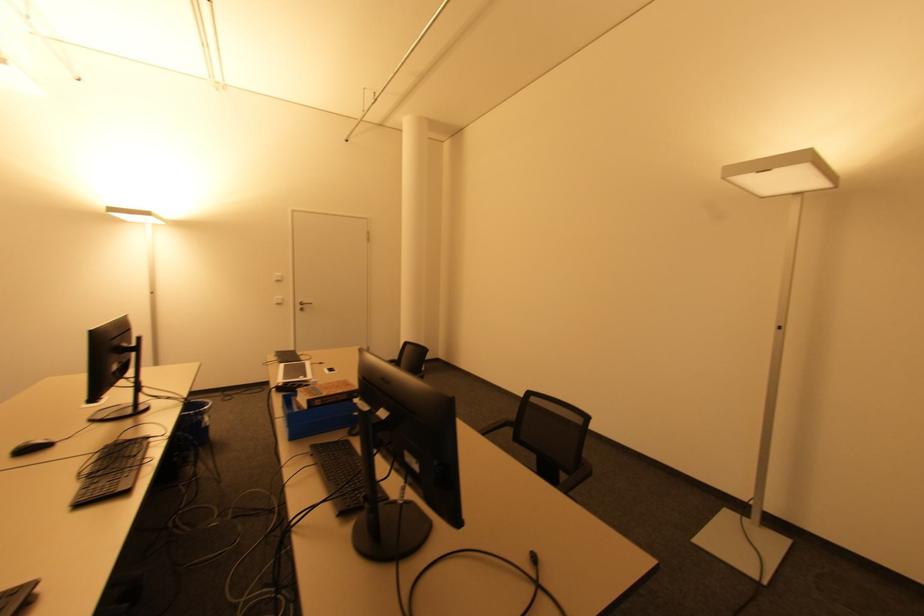
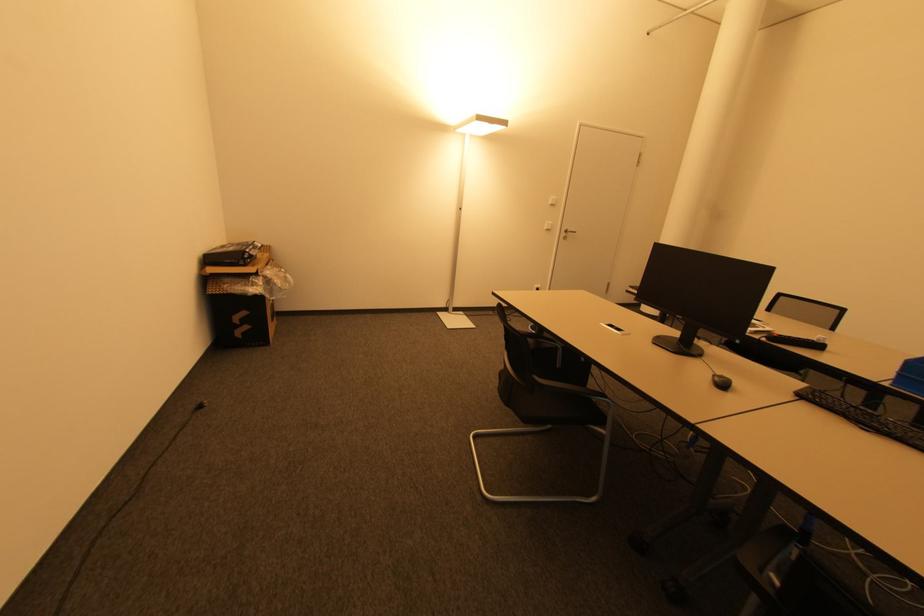
The point at (280, 280) is marked in the first image. Where is the corresponding point in the second image?

(554, 204)